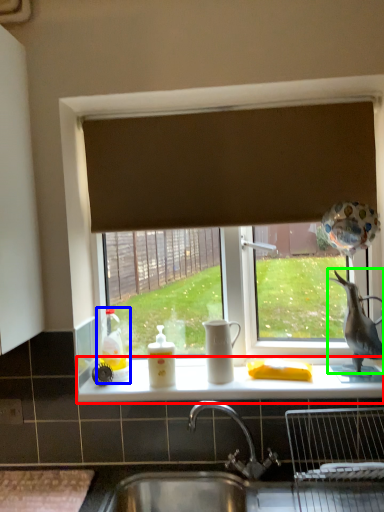
Question: Considering the real-world distances, which object is closest to counter top (highlighted by a red box)? toy (highlighted by a blue box) or animal (highlighted by a green box).

Choices:
 (A) toy
 (B) animal

Answer: (A)